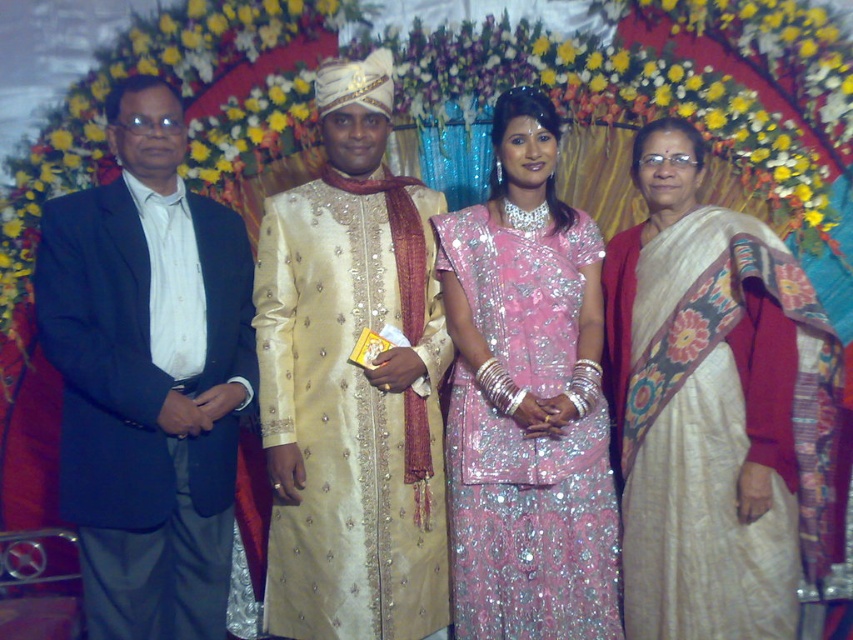
Question: Is dark blue suit at left above gold silk sherwani at center?

Choices:
 (A) yes
 (B) no

Answer: (B)

Question: Which of the following is the closest to the observer?

Choices:
 (A) click(x=579, y=307)
 (B) click(x=703, y=320)
 (C) click(x=364, y=419)

Answer: (B)

Question: Can you confirm if dark blue suit at left is wider than pink sequined saree at center?

Choices:
 (A) yes
 (B) no

Answer: (A)

Question: Is gold silk sherwani at center positioned in front of pink sequined saree at center?

Choices:
 (A) yes
 (B) no

Answer: (B)

Question: Which point is closer to the camera taking this photo?

Choices:
 (A) (630, 451)
 (B) (350, 401)
 (C) (180, 227)

Answer: (C)

Question: Which object is closer to the camera taking this photo?

Choices:
 (A) pink sequined saree at center
 (B) white silk saree at right
 (C) dark blue suit at left
 (D) gold silk sherwani at center

Answer: (C)